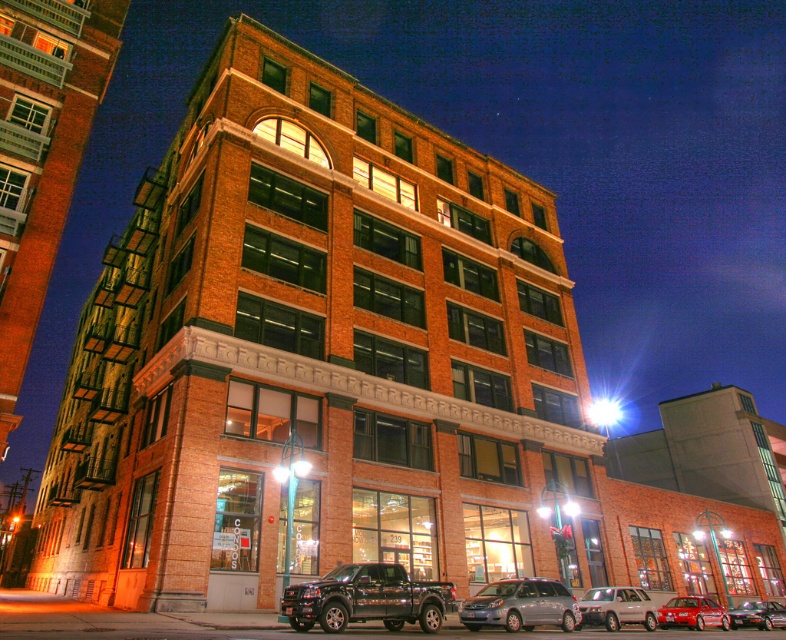
You are standing on the sidewalk in front of the building and want to walk towards the entrance. There are two points marked on the ground ahead of you. The first point is at coordinate point(720,621) and the second is at point(758,625). Which point is closer to the entrance of the building?

Point(720,621) is in front of point(758,625), so it is closer to the entrance of the building.

You are a delivery person needing to park your vehicle between the satin silver van at center and the shiny red sedan at lower right. Is there enough space for your vehicle, which is 5 meters long?

The satin silver van at center is positioned on the left side of the shiny red sedan at lower right. However, the distance between them isn not specified in the objects description, so we cannot determine if there is enough space for a 5 meter long vehicle.

What are the coordinates of the satin silver van at center?

The satin silver van at center is located at coordinates point (520, 605).